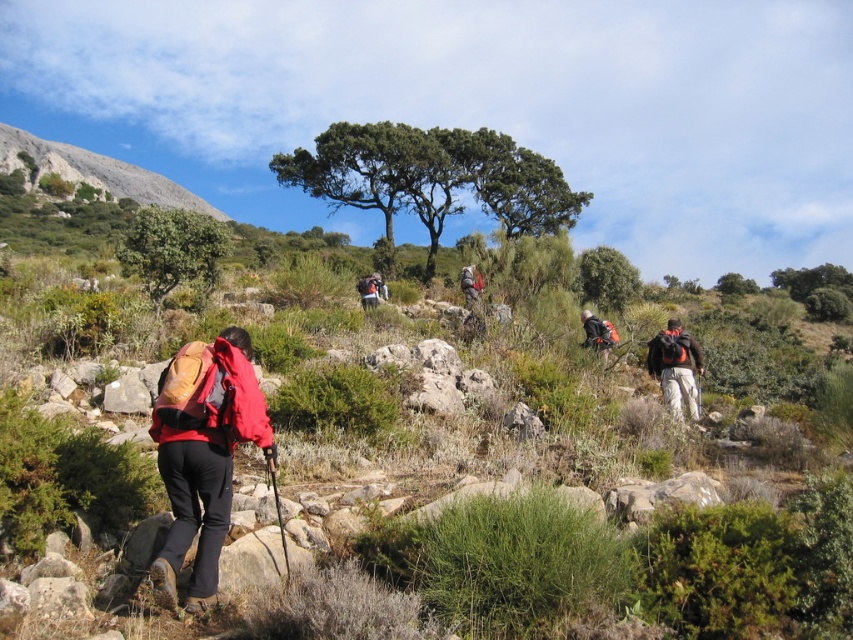
Question: Does matte red backpack at center appear over matte gray backpack at center?

Choices:
 (A) yes
 (B) no

Answer: (A)

Question: Which object is positioned closest to the matte red backpack at center?

Choices:
 (A) matte black backpack at center-right
 (B) matte red jacket at lower left

Answer: (A)

Question: Which object appears farthest from the camera in this image?

Choices:
 (A) matte gray backpack at center
 (B) matte black backpack at center-right

Answer: (A)

Question: Can you confirm if matte red jacket at lower left is positioned below matte gray backpack at center?

Choices:
 (A) yes
 (B) no

Answer: (A)

Question: Which object is the farthest from the matte black backpack at center-right?

Choices:
 (A) matte red backpack at center
 (B) matte black backpack at right
 (C) matte gray backpack at center

Answer: (A)

Question: Is matte red jacket at lower left to the left of matte black backpack at right from the viewer's perspective?

Choices:
 (A) no
 (B) yes

Answer: (B)